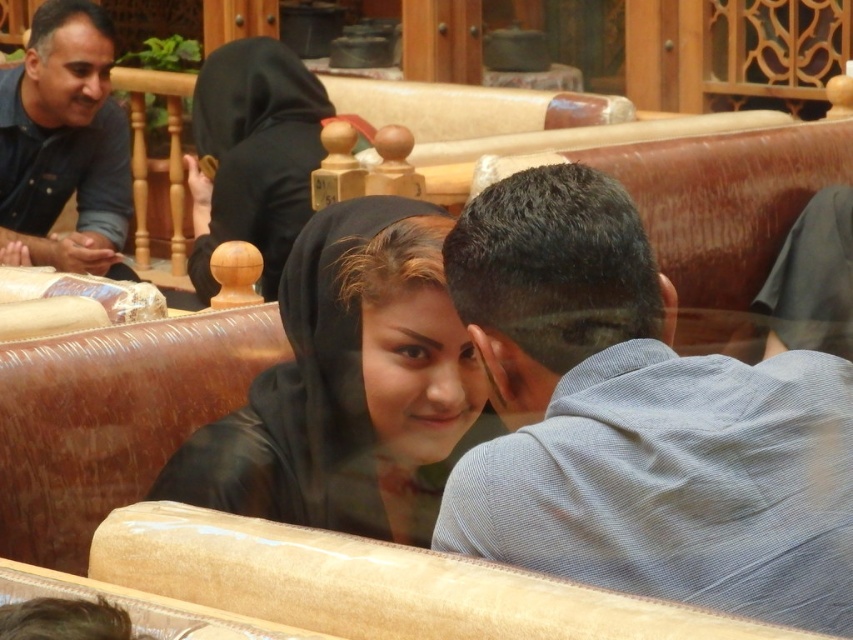
Question: Based on their relative distances, which object is nearer to the black matte hijab at upper left?

Choices:
 (A) light blue striped shirt at center
 (B) black satin hijab at center
 (C) blue denim shirt at upper left

Answer: (C)

Question: Among these objects, which one is farthest from the camera?

Choices:
 (A) black satin hijab at center
 (B) blue denim shirt at upper left
 (C) light blue striped shirt at center
 (D) black matte hijab at upper left

Answer: (B)

Question: In this image, where is blue denim shirt at upper left located relative to black matte hijab at upper left?

Choices:
 (A) left
 (B) right

Answer: (A)

Question: Which of these objects is positioned farthest from the black matte hijab at upper left?

Choices:
 (A) light blue striped shirt at center
 (B) black satin hijab at center
 (C) blue denim shirt at upper left

Answer: (A)

Question: Where is blue denim shirt at upper left located in relation to black matte hijab at upper left in the image?

Choices:
 (A) below
 (B) above

Answer: (B)

Question: Is black satin hijab at center above black matte hijab at upper left?

Choices:
 (A) yes
 (B) no

Answer: (B)